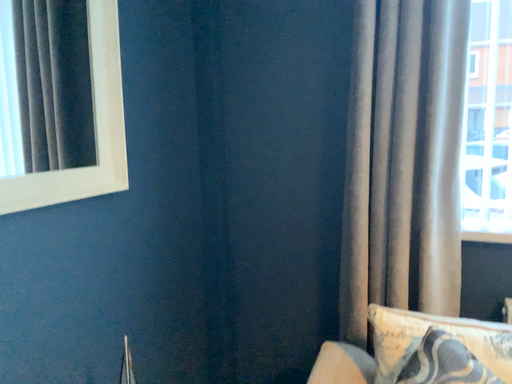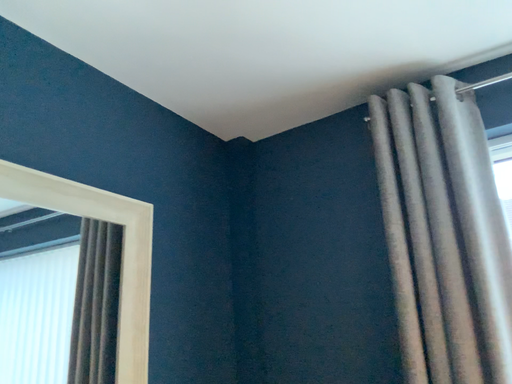
Question: Which way did the camera rotate in the video?

Choices:
 (A) rotated right
 (B) rotated left

Answer: (B)